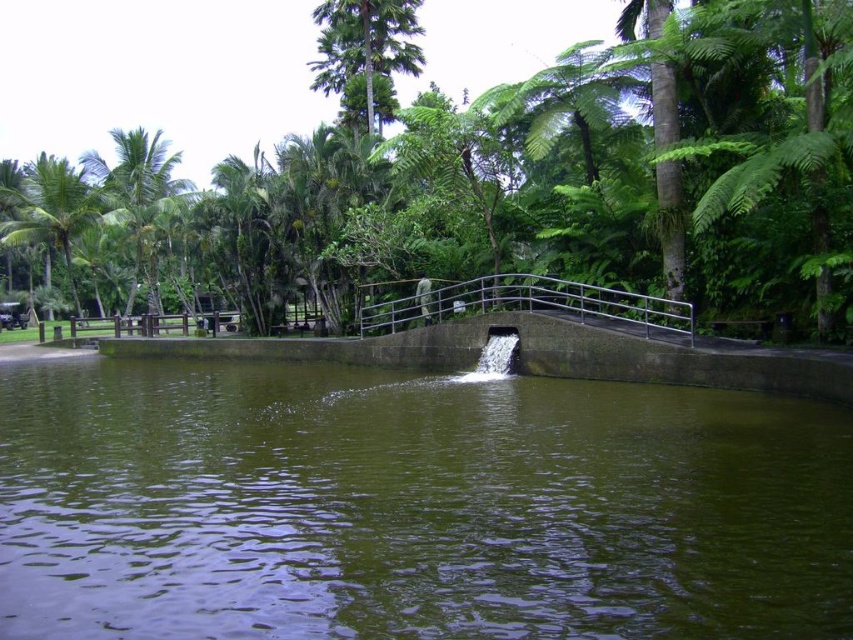
Question: Estimate the real-world distances between objects in this image. Which object is closer to the green leafy tree at center?

Choices:
 (A) green concrete river at center
 (B) silver metallic railing at center
 (C) green leafy palm tree at upper left

Answer: (C)

Question: Can you confirm if silver metallic railing at center is thinner than green leafy palm tree at left?

Choices:
 (A) no
 (B) yes

Answer: (B)

Question: Estimate the real-world distances between objects in this image. Which object is farther from the green leafy tree at center?

Choices:
 (A) green concrete river at center
 (B) silver metallic railing at center
 (C) green leafy palm tree at upper left
 (D) green leafy palm tree at left

Answer: (A)

Question: Can you confirm if green concrete river at center is positioned to the left of green leafy tree at center?

Choices:
 (A) no
 (B) yes

Answer: (A)

Question: Which point is closer to the camera?

Choices:
 (A) green leafy palm tree at upper left
 (B) green leafy palm tree at left
 (C) silver metallic railing at center
 (D) green leafy tree at center

Answer: (D)

Question: Can you confirm if green leafy tree at center is bigger than green leafy palm tree at upper left?

Choices:
 (A) no
 (B) yes

Answer: (B)